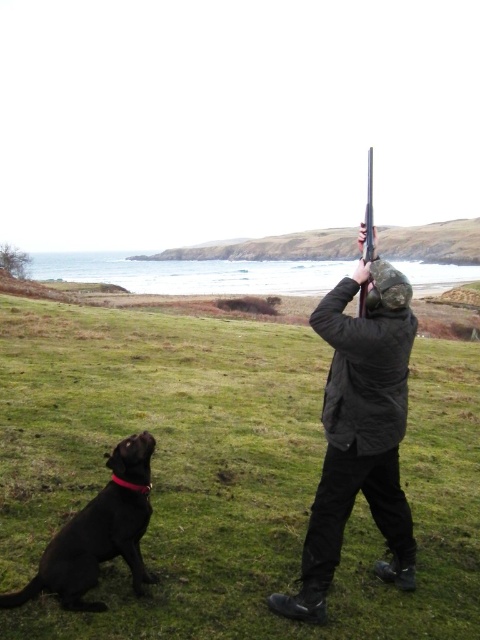
Question: Which object is positioned farthest from the shiny black dog at lower left?

Choices:
 (A) black matte jacket at center
 (B) polished wood shotgun at upper center
 (C) green grassy field at center

Answer: (B)

Question: Can you confirm if green grassy field at center is positioned to the right of polished wood shotgun at upper center?

Choices:
 (A) no
 (B) yes

Answer: (A)

Question: Is green grassy field at center positioned in front of shiny black dog at lower left?

Choices:
 (A) yes
 (B) no

Answer: (A)

Question: Is green grassy field at center below polished wood shotgun at upper center?

Choices:
 (A) yes
 (B) no

Answer: (A)

Question: Which object is positioned farthest from the polished wood shotgun at upper center?

Choices:
 (A) shiny black dog at lower left
 (B) green grassy field at center

Answer: (B)

Question: Which of the following is the farthest from the observer?

Choices:
 (A) green grassy field at center
 (B) polished wood shotgun at upper center
 (C) shiny black dog at lower left
 (D) black matte jacket at center

Answer: (B)